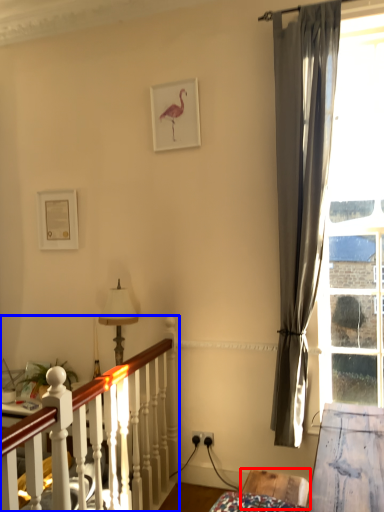
Question: Which object appears farthest to the camera in this image, furniture (highlighted by a red box) or bed frame (highlighted by a blue box)?

Choices:
 (A) furniture
 (B) bed frame

Answer: (A)